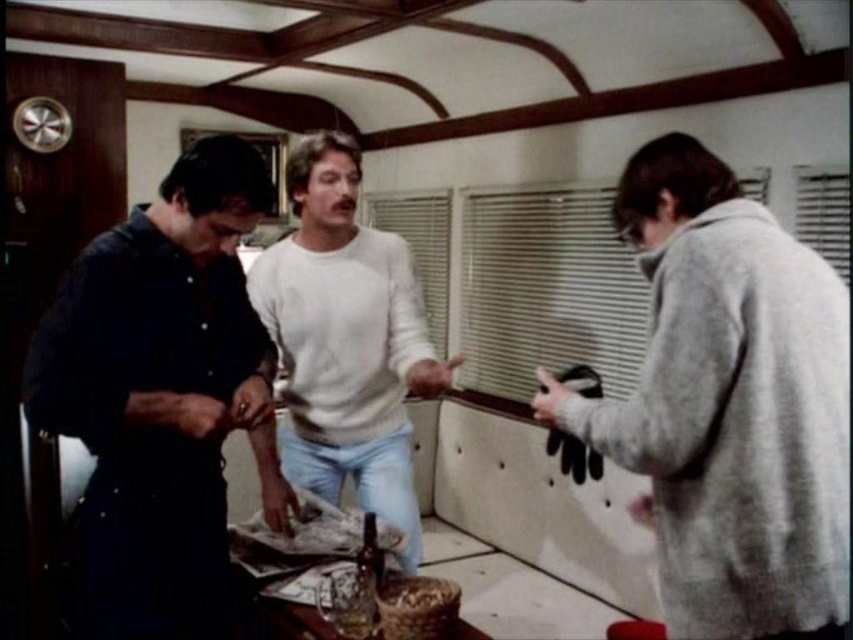
Question: Among these objects, which one is farthest from the camera?

Choices:
 (A) white soft sweater at center
 (B) gray wool sweater at right
 (C) dark blue shirt at left
 (D) shiny brown bottle at center

Answer: (A)

Question: Which of the following is the closest to the observer?

Choices:
 (A) dark blue shirt at left
 (B) shiny brown bottle at center
 (C) white soft sweater at center

Answer: (A)

Question: Which is farther from the gray wool sweater at right?

Choices:
 (A) shiny brown bottle at center
 (B) dark blue shirt at left

Answer: (B)

Question: From the image, what is the correct spatial relationship of gray wool sweater at right in relation to shiny brown bottle at center?

Choices:
 (A) left
 (B) right

Answer: (B)

Question: Is dark blue shirt at left thinner than white soft sweater at center?

Choices:
 (A) yes
 (B) no

Answer: (A)

Question: Can you confirm if gray wool sweater at right is smaller than white soft sweater at center?

Choices:
 (A) yes
 (B) no

Answer: (A)